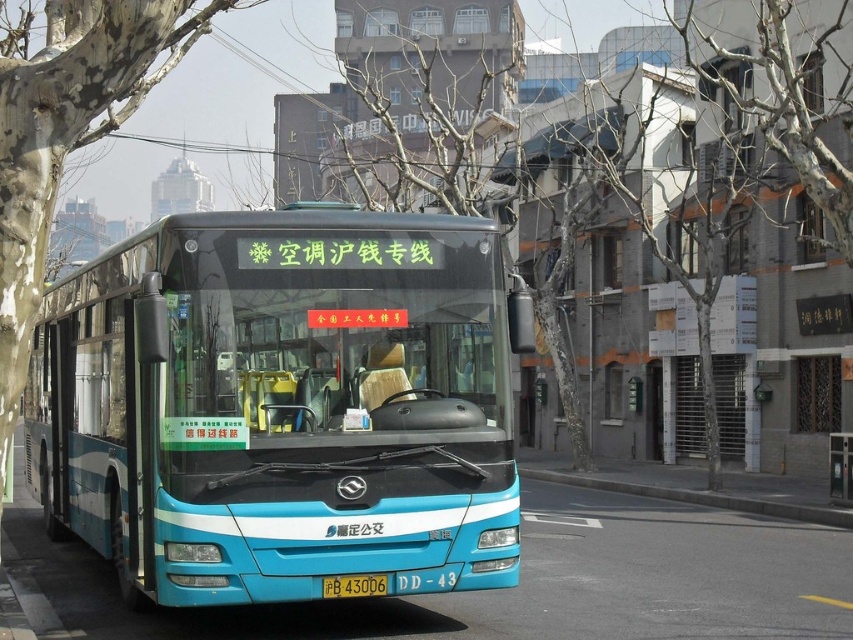
Question: Estimate the real-world distances between objects in this image. Which object is farther from the gray concrete curb at lower center?

Choices:
 (A) blue metallic bus at center
 (B) smooth bark tree at left
 (C) yellow matte license plate at center
 (D) wooden signboard at right

Answer: (B)

Question: Considering the real-world distances, which object is farthest from the gray concrete curb at lower center?

Choices:
 (A) blue metallic bus at center
 (B) yellow matte license plate at center
 (C) wooden signboard at right

Answer: (A)

Question: Is wooden signboard at right smaller than gray concrete curb at lower center?

Choices:
 (A) no
 (B) yes

Answer: (B)

Question: Can you confirm if smooth bark tree at left is bigger than yellow matte license plate at center?

Choices:
 (A) no
 (B) yes

Answer: (B)

Question: Which object is positioned closest to the blue metallic bus at center?

Choices:
 (A) smooth bark tree at left
 (B) yellow matte license plate at center

Answer: (B)

Question: From the image, what is the correct spatial relationship of smooth bark tree at left in relation to wooden signboard at right?

Choices:
 (A) right
 (B) left

Answer: (B)